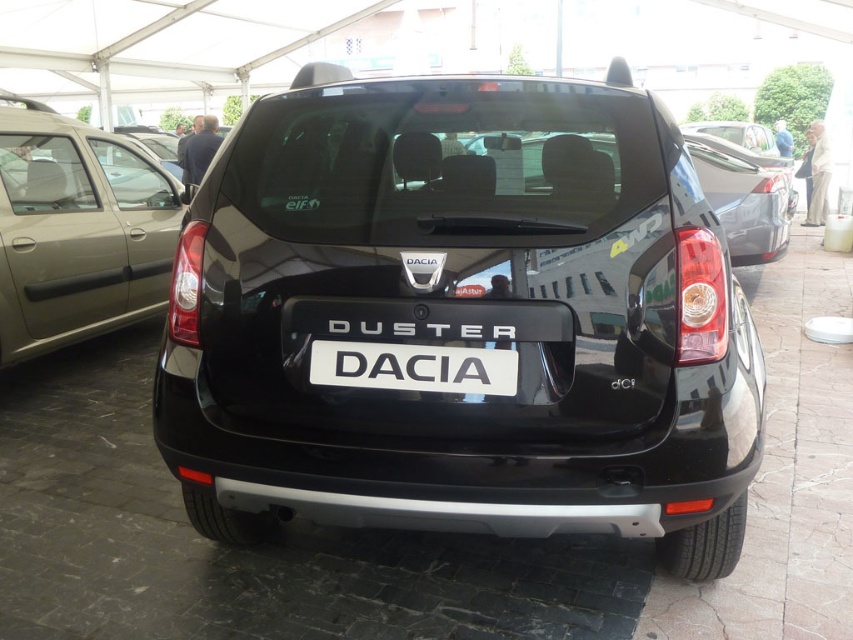
Who is taller, matte black minivan at left or white plastic license plate at center?

With more height is matte black minivan at left.

At what (x,y) coordinates should I click in order to perform the action: click on matte black minivan at left. Please return your answer as a coordinate pair (x, y). The height and width of the screenshot is (640, 853). Looking at the image, I should click on 77,230.

Identify the location of matte black minivan at left. (77, 230).

The image size is (853, 640). Describe the element at coordinates (463, 317) in the screenshot. I see `glossy black car at center` at that location.

Is glossy black car at center to the left of white plastic license plate at center from the viewer's perspective?

No, glossy black car at center is not to the left of white plastic license plate at center.

Which is in front, point (527, 211) or point (480, 356)?

Point (480, 356) is in front.

At what (x,y) coordinates should I click in order to perform the action: click on glossy black car at center. Please return your answer as a coordinate pair (x, y). This screenshot has height=640, width=853. Looking at the image, I should click on (463, 317).

Who is positioned more to the left, glossy black car at center or matte black minivan at left?

From the viewer's perspective, matte black minivan at left appears more on the left side.

Consider the image. Is glossy black car at center above matte black minivan at left?

Incorrect, glossy black car at center is not positioned above matte black minivan at left.

You are a GUI agent. You are given a task and a screenshot of the screen. Output one action in this format:
    pyautogui.click(x=<x>, y=<y>)
    Task: Click on the glossy black car at center
    
    Given the screenshot: What is the action you would take?
    pyautogui.click(x=463, y=317)

The height and width of the screenshot is (640, 853). I want to click on glossy black car at center, so click(463, 317).